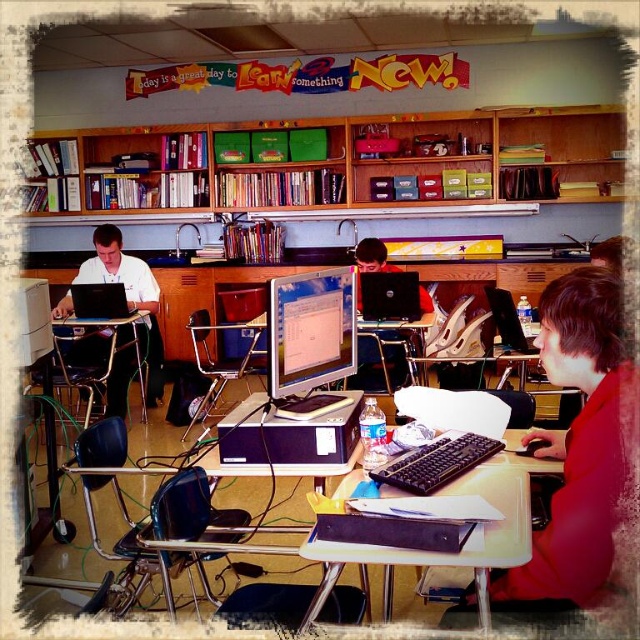
Does wooden bookshelf at upper center appear under red matte shirt at center?

No, wooden bookshelf at upper center is not below red matte shirt at center.

Which is in front, point (202, 209) or point (557, 280)?

Point (557, 280)

Locate an element on the screen. The width and height of the screenshot is (640, 640). wooden bookshelf at upper center is located at coordinates (385, 161).

Is point (321, 352) closer to viewer compared to point (276, 460)?

No, it is not.

Image resolution: width=640 pixels, height=640 pixels. What do you see at coordinates (310, 330) in the screenshot?
I see `matte black monitor at center` at bounding box center [310, 330].

What are the coordinates of `matte black monitor at center` in the screenshot? It's located at (310, 330).

I want to click on matte black monitor at center, so click(x=310, y=330).

At what (x,y) coordinates should I click in order to perform the action: click on matte black monitor at center. Please return your answer as a coordinate pair (x, y). Image resolution: width=640 pixels, height=640 pixels. Looking at the image, I should click on (310, 330).

Image resolution: width=640 pixels, height=640 pixels. Identify the location of matte black monitor at center. (310, 330).